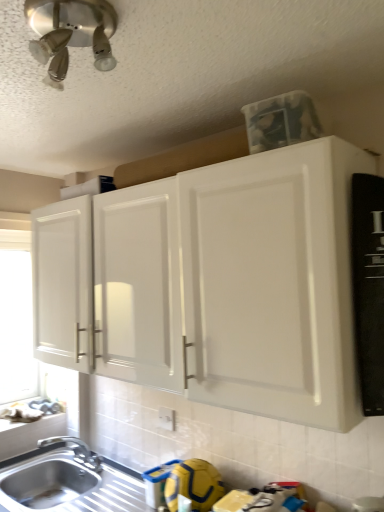
Question: Is white matte window screen at left at the right side of white matte window sill at lower left?

Choices:
 (A) yes
 (B) no

Answer: (B)

Question: Is white matte window screen at left not inside white matte window sill at lower left?

Choices:
 (A) yes
 (B) no

Answer: (A)

Question: Considering the relative positions of white matte window screen at left and white matte window sill at lower left in the image provided, is white matte window screen at left to the left of white matte window sill at lower left from the viewer's perspective?

Choices:
 (A) yes
 (B) no

Answer: (A)

Question: Does white matte window screen at left have a lesser width compared to white matte window sill at lower left?

Choices:
 (A) no
 (B) yes

Answer: (B)

Question: Considering the relative positions of white matte window screen at left and white matte window sill at lower left in the image provided, is white matte window screen at left behind white matte window sill at lower left?

Choices:
 (A) yes
 (B) no

Answer: (A)

Question: Is white matte window screen at left oriented away from white matte window sill at lower left?

Choices:
 (A) no
 (B) yes

Answer: (A)

Question: Can you confirm if white matte cabinet at upper center is shorter than satin nickel light fixture at upper left?

Choices:
 (A) no
 (B) yes

Answer: (A)

Question: Is white matte cabinet at upper center surrounding satin nickel light fixture at upper left?

Choices:
 (A) no
 (B) yes

Answer: (A)

Question: From the image's perspective, is white matte cabinet at upper center on top of satin nickel light fixture at upper left?

Choices:
 (A) no
 (B) yes

Answer: (A)

Question: Is white matte cabinet at upper center positioned before satin nickel light fixture at upper left?

Choices:
 (A) no
 (B) yes

Answer: (A)

Question: Does white matte cabinet at upper center have a greater height compared to satin nickel light fixture at upper left?

Choices:
 (A) yes
 (B) no

Answer: (A)

Question: Can you confirm if white matte cabinet at upper center is wider than satin nickel light fixture at upper left?

Choices:
 (A) yes
 (B) no

Answer: (A)

Question: Does white matte cabinet at upper center turn towards stainless steel sink at lower left?

Choices:
 (A) no
 (B) yes

Answer: (A)